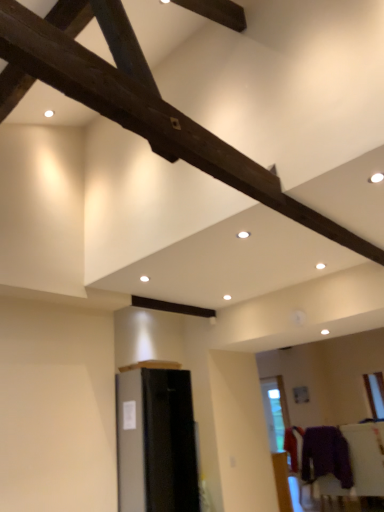
What do you see at coordinates (354, 465) in the screenshot? Image resolution: width=384 pixels, height=512 pixels. I see `purple fabric at lower right, arranged as the first furniture when ordered from the bottom` at bounding box center [354, 465].

Find the location of `purple fabric at lower right, acting as the first furniture starting from the right`. purple fabric at lower right, acting as the first furniture starting from the right is located at coordinates (354, 465).

Which object is thinner, satin black refrigerator at lower left, arranged as the first furniture when viewed from the front, or purple fabric at lower right, acting as the first furniture starting from the right?

Thinner between the two is purple fabric at lower right, acting as the first furniture starting from the right.

From a real-world perspective, who is located lower, satin black refrigerator at lower left, which is the second furniture in bottom-to-top order, or purple fabric at lower right, marked as the 1th furniture in a back-to-front arrangement?

From a 3D spatial view, purple fabric at lower right, marked as the 1th furniture in a back-to-front arrangement, is below.

Is there a large distance between satin black refrigerator at lower left, which appears as the 2th furniture when viewed from the right, and purple fabric at lower right, acting as the first furniture starting from the right?

satin black refrigerator at lower left, which appears as the 2th furniture when viewed from the right, is far away from purple fabric at lower right, acting as the first furniture starting from the right.

Between satin black refrigerator at lower left, which is the second furniture in bottom-to-top order, and purple fabric at lower right, marked as the 2th furniture in a top-to-bottom arrangement, which one has more height?

With more height is satin black refrigerator at lower left, which is the second furniture in bottom-to-top order.

Considering the sizes of objects purple fabric at lower right, arranged as the first furniture when ordered from the bottom, and purple fuzzy sweater at lower right in the image provided, who is shorter, purple fabric at lower right, arranged as the first furniture when ordered from the bottom, or purple fuzzy sweater at lower right?

With less height is purple fuzzy sweater at lower right.

Does purple fabric at lower right, marked as the 1th furniture in a back-to-front arrangement, turn towards purple fuzzy sweater at lower right?

Yes.

In terms of width, does purple fabric at lower right, arranged as the 2th furniture when viewed from the front, look wider or thinner when compared to purple fuzzy sweater at lower right?

In the image, purple fabric at lower right, arranged as the 2th furniture when viewed from the front, appears to be wider than purple fuzzy sweater at lower right.

What's the angular difference between purple fuzzy sweater at lower right and purple fabric at lower right, arranged as the first furniture when ordered from the bottom,'s facing directions?

They differ by 0.00176 degrees in their facing directions.

Is purple fuzzy sweater at lower right at the right side of purple fabric at lower right, which is the second furniture in left-to-right order?

No, purple fuzzy sweater at lower right is not to the right of purple fabric at lower right, which is the second furniture in left-to-right order.

From their relative heights in the image, would you say purple fuzzy sweater at lower right is taller or shorter than purple fabric at lower right, which is the second furniture in left-to-right order?

purple fuzzy sweater at lower right is shorter than purple fabric at lower right, which is the second furniture in left-to-right order.

You are a GUI agent. You are given a task and a screenshot of the screen. Output one action in this format:
    pyautogui.click(x=<x>, y=<y>)
    Task: Click on the clothing that is above the purple fabric at lower right, marked as the 2th furniture in a top-to-bottom arrangement (from the image's perspective)
    The height and width of the screenshot is (512, 384).
    Given the screenshot: What is the action you would take?
    pyautogui.click(x=326, y=455)

Identify the location of clothing below the satin black refrigerator at lower left, arranged as the first furniture when viewed from the front (from the image's perspective). (326, 455).

Does purple fuzzy sweater at lower right lie in front of satin black refrigerator at lower left, which appears as the 2th furniture when viewed from the right?

No, the depth of purple fuzzy sweater at lower right is greater than that of satin black refrigerator at lower left, which appears as the 2th furniture when viewed from the right.

Who is bigger, purple fuzzy sweater at lower right or satin black refrigerator at lower left, marked as the second furniture in a back-to-front arrangement?

With larger size is satin black refrigerator at lower left, marked as the second furniture in a back-to-front arrangement.

Choose the correct answer: Is purple fuzzy sweater at lower right inside satin black refrigerator at lower left, arranged as the first furniture when viewed from the front, or outside it?

purple fuzzy sweater at lower right is located beyond the bounds of satin black refrigerator at lower left, arranged as the first furniture when viewed from the front.

Between satin black refrigerator at lower left, arranged as the first furniture when viewed from the front, and purple fuzzy sweater at lower right, which one has more height?

satin black refrigerator at lower left, arranged as the first furniture when viewed from the front, is taller.

Would you say satin black refrigerator at lower left, positioned as the 1th furniture in left-to-right order, is outside purple fuzzy sweater at lower right?

satin black refrigerator at lower left, positioned as the 1th furniture in left-to-right order, is positioned outside purple fuzzy sweater at lower right.

Is satin black refrigerator at lower left, which appears as the 2th furniture when viewed from the right, oriented towards purple fuzzy sweater at lower right?

No, satin black refrigerator at lower left, which appears as the 2th furniture when viewed from the right, does not turn towards purple fuzzy sweater at lower right.

How different are the orientations of satin black refrigerator at lower left, positioned as the 1th furniture in left-to-right order, and purple fuzzy sweater at lower right in degrees?

There is a 89.2-degree angle between the facing directions of satin black refrigerator at lower left, positioned as the 1th furniture in left-to-right order, and purple fuzzy sweater at lower right.

From a real-world perspective, is purple fabric at lower right, arranged as the first furniture when ordered from the bottom, located beneath satin black refrigerator at lower left, marked as the second furniture in a back-to-front arrangement?

Correct, in the physical world, purple fabric at lower right, arranged as the first furniture when ordered from the bottom, is lower than satin black refrigerator at lower left, marked as the second furniture in a back-to-front arrangement.

Is purple fabric at lower right, marked as the 2th furniture in a top-to-bottom arrangement, shorter than satin black refrigerator at lower left, positioned as the 1th furniture in left-to-right order?

Yes, purple fabric at lower right, marked as the 2th furniture in a top-to-bottom arrangement, is shorter than satin black refrigerator at lower left, positioned as the 1th furniture in left-to-right order.

Is purple fabric at lower right, which is the second furniture in left-to-right order, located outside satin black refrigerator at lower left, marked as the second furniture in a back-to-front arrangement?

Indeed, purple fabric at lower right, which is the second furniture in left-to-right order, is completely outside satin black refrigerator at lower left, marked as the second furniture in a back-to-front arrangement.

Where is `furniture below the satin black refrigerator at lower left, arranged as the first furniture when viewed from the front (from the image's perspective)`? furniture below the satin black refrigerator at lower left, arranged as the first furniture when viewed from the front (from the image's perspective) is located at coordinates (354, 465).

Locate an element on the screen. The height and width of the screenshot is (512, 384). furniture that appears in front of the purple fabric at lower right, acting as the first furniture starting from the right is located at coordinates (156, 441).

Find the location of a particular element. The height and width of the screenshot is (512, 384). furniture on the right of the purple fuzzy sweater at lower right is located at coordinates (354, 465).

Considering their positions, is purple fuzzy sweater at lower right positioned further to satin black refrigerator at lower left, marked as the second furniture in a back-to-front arrangement, than purple fabric at lower right, marked as the 1th furniture in a back-to-front arrangement?

The object further to satin black refrigerator at lower left, marked as the second furniture in a back-to-front arrangement, is purple fuzzy sweater at lower right.

Which object lies nearer to the anchor point purple fabric at lower right, arranged as the 2th furniture when viewed from the front, purple fuzzy sweater at lower right or satin black refrigerator at lower left, the 1th furniture positioned from the top?

purple fuzzy sweater at lower right is positioned closer to the anchor purple fabric at lower right, arranged as the 2th furniture when viewed from the front.

Which object lies further to the anchor point purple fuzzy sweater at lower right, purple fabric at lower right, marked as the 1th furniture in a back-to-front arrangement, or satin black refrigerator at lower left, arranged as the first furniture when viewed from the front?

satin black refrigerator at lower left, arranged as the first furniture when viewed from the front, is positioned further to the anchor purple fuzzy sweater at lower right.

Based on their spatial positions, is satin black refrigerator at lower left, positioned as the 1th furniture in left-to-right order, or purple fabric at lower right, acting as the first furniture starting from the right, closer to purple fuzzy sweater at lower right?

purple fabric at lower right, acting as the first furniture starting from the right, lies closer to purple fuzzy sweater at lower right than the other object.

Based on their spatial positions, is satin black refrigerator at lower left, which appears as the 2th furniture when viewed from the right, or purple fuzzy sweater at lower right closer to purple fabric at lower right, acting as the first furniture starting from the right?

The object closer to purple fabric at lower right, acting as the first furniture starting from the right, is purple fuzzy sweater at lower right.

Based on the photo, from the image, which object appears to be farther from satin black refrigerator at lower left, positioned as the 1th furniture in left-to-right order, purple fabric at lower right, which is the second furniture in left-to-right order, or purple fuzzy sweater at lower right?

purple fuzzy sweater at lower right lies further to satin black refrigerator at lower left, positioned as the 1th furniture in left-to-right order, than the other object.

This screenshot has width=384, height=512. I want to click on clothing between satin black refrigerator at lower left, marked as the second furniture in a back-to-front arrangement, and purple fabric at lower right, arranged as the first furniture when ordered from the bottom, in the front-back direction, so click(x=326, y=455).